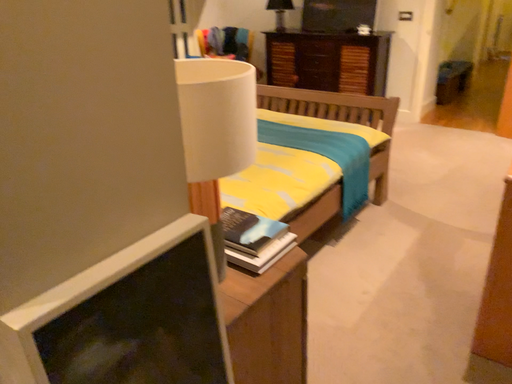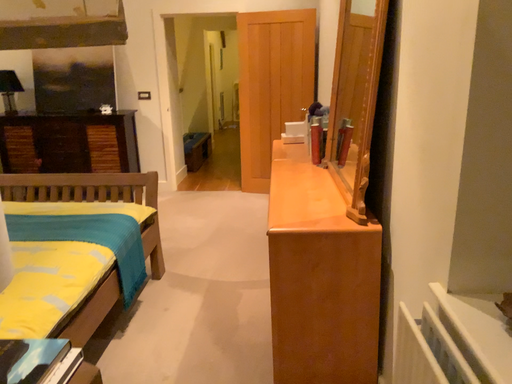
Question: How did the camera likely rotate when shooting the video?

Choices:
 (A) rotated downward
 (B) rotated upward

Answer: (B)